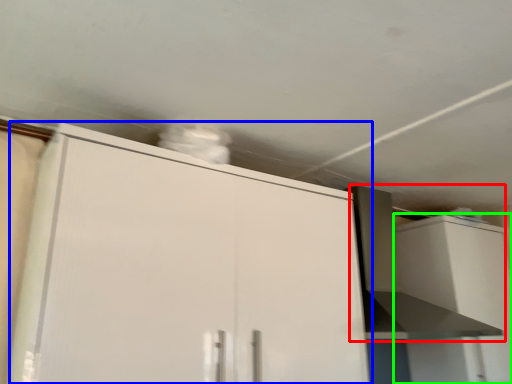
Question: Which object is the farthest from vent (highlighted by a red box)? Choose among these: cabinetry (highlighted by a blue box) or cabinetry (highlighted by a green box).

Choices:
 (A) cabinetry
 (B) cabinetry

Answer: (A)